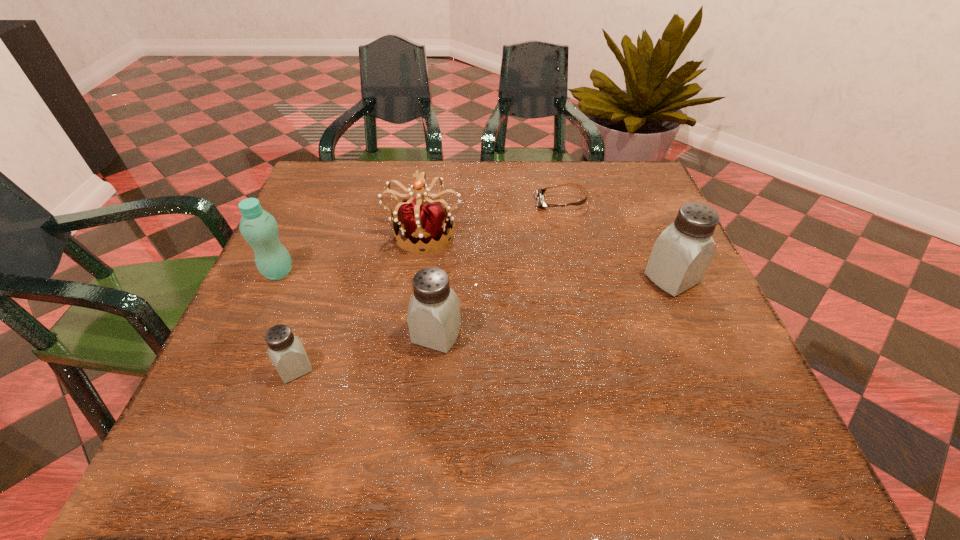
Find the location of `saltshaker present at the left edge`. saltshaker present at the left edge is located at coordinates (285, 350).

At what (x,y) coordinates should I click in order to perform the action: click on bottle that is at the left edge. Please return your answer as a coordinate pair (x, y). Looking at the image, I should click on (259, 228).

Find the location of a particular element. The image size is (960, 540). object that is at the right edge is located at coordinates (682, 254).

I want to click on object at the near left corner, so click(285, 350).

Locate an element on the screen. free point at the far edge is located at coordinates point(519,171).

In order to click on vacant space at the near edge of the desktop in this screenshot , I will do `click(516, 368)`.

Where is `free space at the left edge of the desktop`? Image resolution: width=960 pixels, height=540 pixels. free space at the left edge of the desktop is located at coordinates (290, 284).

Find the location of a particular element. The image size is (960, 540). vacant space at the right edge of the desktop is located at coordinates (632, 248).

You are a GUI agent. You are given a task and a screenshot of the screen. Output one action in this format:
    pyautogui.click(x=<x>, y=<y>)
    Task: Click on the free spot at the far left corner of the desktop
    This screenshot has width=960, height=540.
    Given the screenshot: What is the action you would take?
    pyautogui.click(x=336, y=208)

Locate an element on the screen. free space at the near left corner is located at coordinates (215, 403).